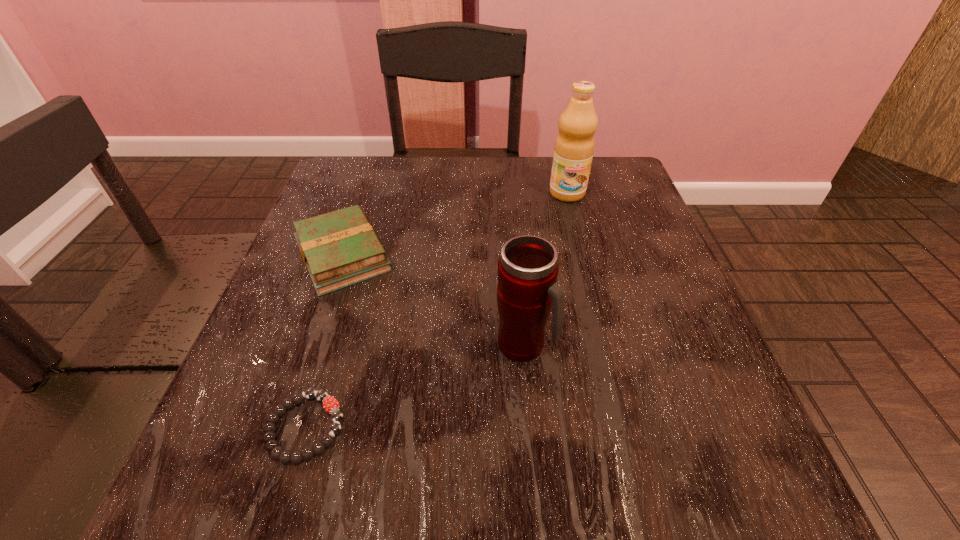
Where is `free space located on the front of the book`? free space located on the front of the book is located at coordinates (263, 494).

You are a GUI agent. You are given a task and a screenshot of the screen. Output one action in this format:
    pyautogui.click(x=<x>, y=<y>)
    Task: Click on the free region located on the right of the bracelet
    This screenshot has width=960, height=540.
    Given the screenshot: What is the action you would take?
    pyautogui.click(x=408, y=427)

Locate an element on the screen. This screenshot has width=960, height=540. object that is positioned at the far edge is located at coordinates (574, 146).

Where is `object that is positioned at the near edge`? Image resolution: width=960 pixels, height=540 pixels. object that is positioned at the near edge is located at coordinates (330, 404).

You are a GUI agent. You are given a task and a screenshot of the screen. Output one action in this format:
    pyautogui.click(x=<x>, y=<y>)
    Task: Click on the book that is at the left edge
    
    Given the screenshot: What is the action you would take?
    pyautogui.click(x=340, y=248)

This screenshot has width=960, height=540. Identify the location of bracelet positioned at the left edge. (330, 404).

Where is `object that is positioned at the right edge`? This screenshot has height=540, width=960. object that is positioned at the right edge is located at coordinates (574, 146).

Where is `object that is positioned at the near left corner`? The image size is (960, 540). object that is positioned at the near left corner is located at coordinates (330, 404).

In order to click on object positioned at the far right corner in this screenshot , I will do `click(574, 146)`.

Locate an element on the screen. vacant region at the far edge of the desktop is located at coordinates (444, 176).